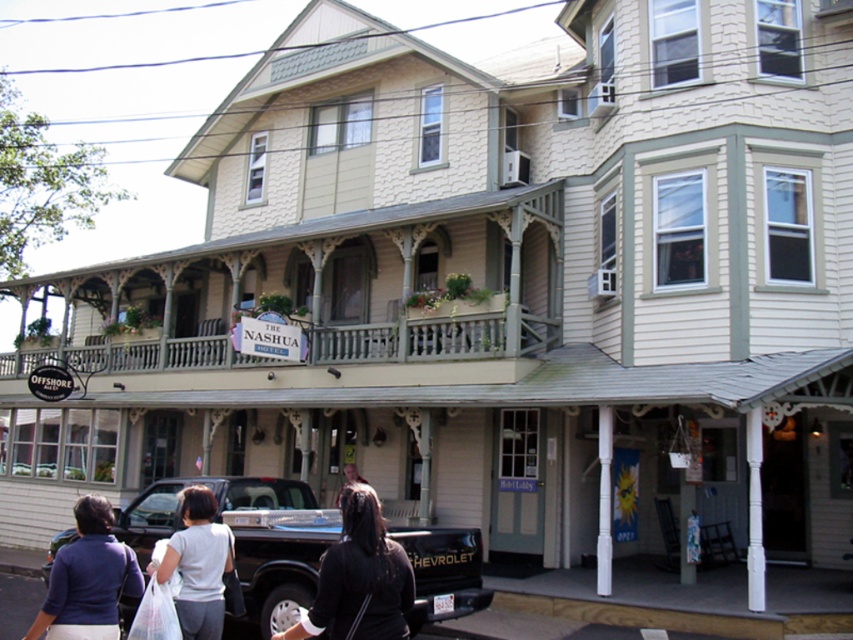
You are standing in front of The Nashua Hotel and need to enter the lobby. You see a wooden porch at center and a dark blue sweater at lower left. Which object is closer to you as you approach the entrance?

The wooden porch at center is closer to you than the dark blue sweater at lower left because the wooden porch at center is further to the viewer than dark blue sweater at lower left.